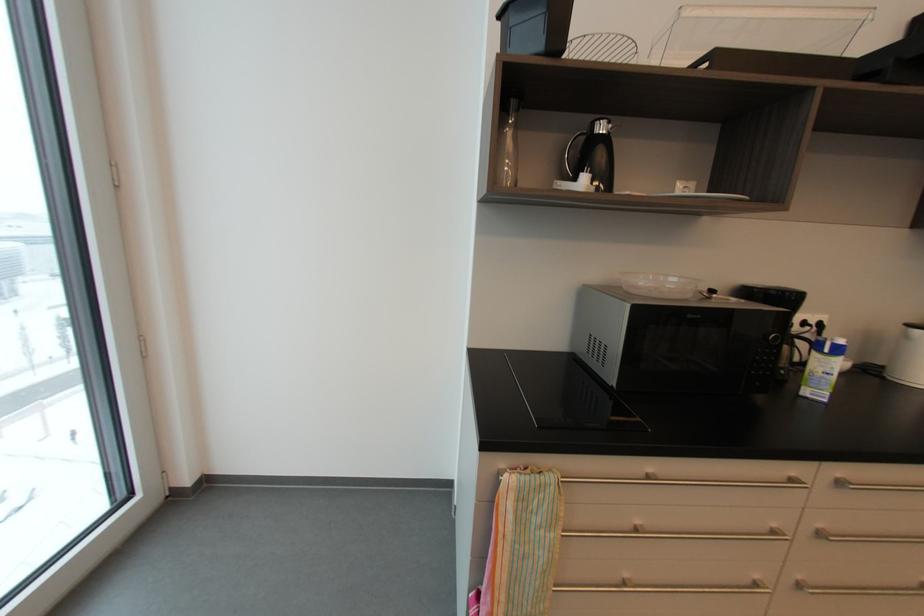
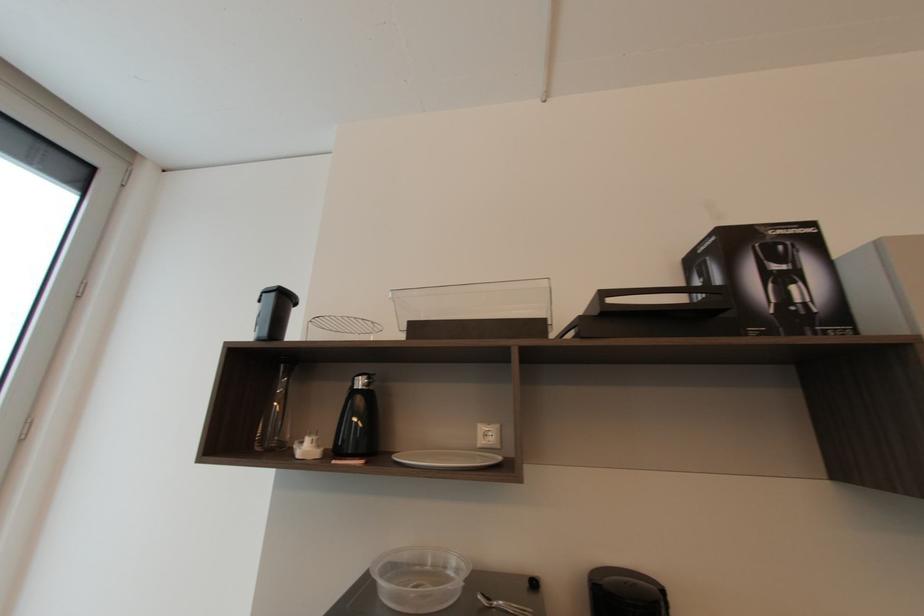
The point at [603,128] is marked in the first image. Where is the corresponding point in the second image?

(362, 384)